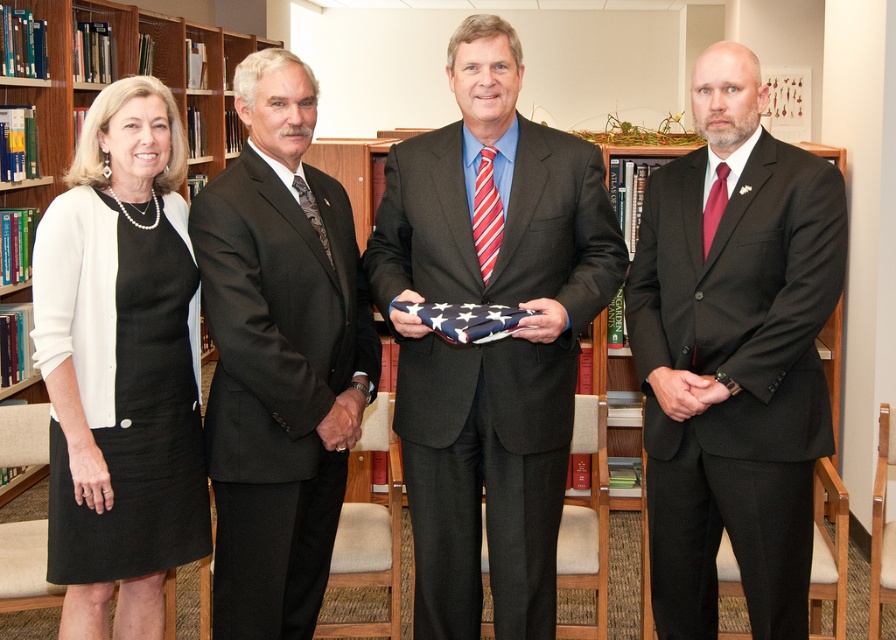
Between matte black suit at right and wooden bookcase at left, which one appears on the left side from the viewer's perspective?

wooden bookcase at left is more to the left.

Does matte black suit at right appear under wooden bookcase at left?

Indeed, matte black suit at right is positioned under wooden bookcase at left.

Between point (691, 396) and point (70, 6), which one is positioned in front?

Point (691, 396)

Image resolution: width=896 pixels, height=640 pixels. I want to click on matte black suit at right, so click(734, 355).

Between point (291, 109) and point (101, 132), which one is positioned in front?

Point (101, 132)

Is black suit at center below white matte dress at left?

Incorrect, black suit at center is not positioned below white matte dress at left.

Who is more forward, (289, 67) or (153, 116)?

Point (153, 116) is in front.

Where is `black suit at center`? black suit at center is located at coordinates (279, 356).

This screenshot has width=896, height=640. What do you see at coordinates (490, 340) in the screenshot?
I see `matte black suit at center` at bounding box center [490, 340].

Image resolution: width=896 pixels, height=640 pixels. In order to click on matte black suit at center in this screenshot , I will do `click(490, 340)`.